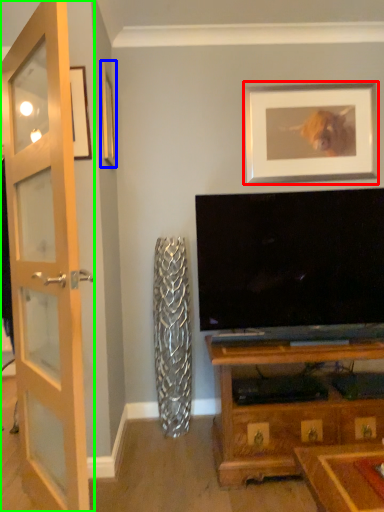
Question: Which is nearer to the picture frame (highlighted by a red box)? picture frame (highlighted by a blue box) or door (highlighted by a green box).

Choices:
 (A) picture frame
 (B) door

Answer: (A)